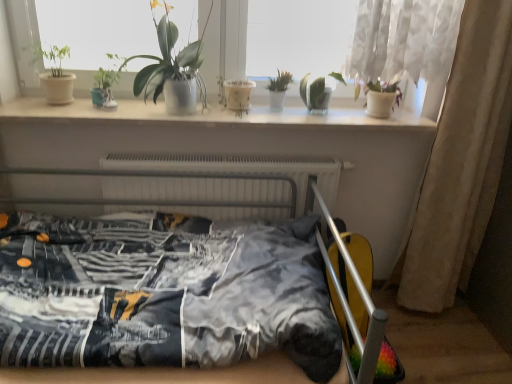
This screenshot has width=512, height=384. I want to click on vacant region above white glossy window sill at upper center (from a real-world perspective), so click(x=208, y=107).